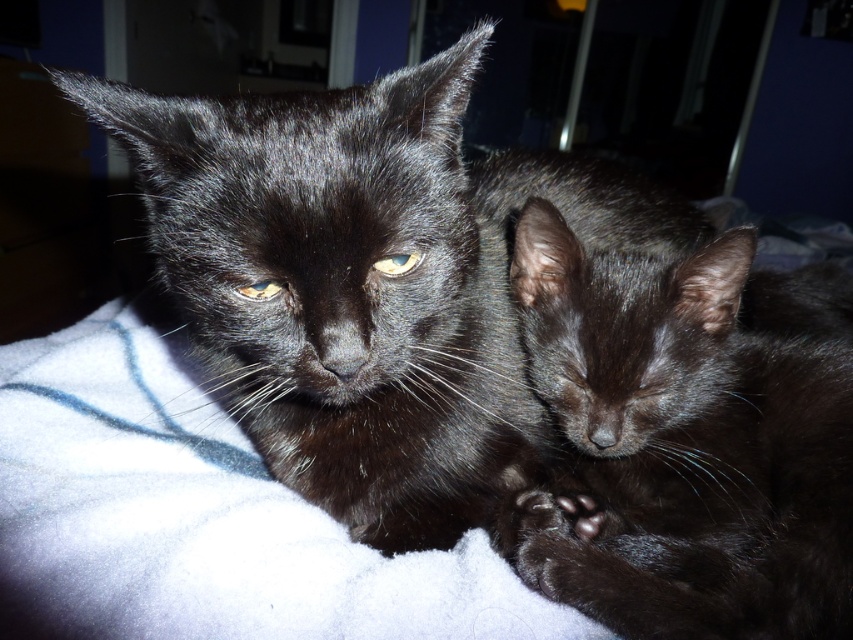
You are a photographer trying to capture the shiny black cat at center. Based on its position, where should you aim your camera to ensure it is centered in the frame?

To center the shiny black cat at center in the frame, aim your camera at the point with coordinates 0.442 on the x axis and 0.431 on the y axis.

You are a photographer trying to capture a closeup of both the shiny black kitten at center and the matte black eye at center in the image. Which object should you focus on to ensure it fills more of the frame?

The shiny black kitten at center might be wider than matte black eye at center, so focusing on the shiny black kitten at center would fill more of the frame.

You are a photographer trying to capture a closeup shot of the shiny black cat at center and the matte black eye at center. Since the lighting is dim, you need to adjust your camera settings. Which object should you focus on first to ensure proper exposure, the one closer to the light source or the one farther away?

The shiny black cat at center is to the right of matte black eye at center. Since the faint glow is coming from behind them, the object closer to the light source would be the one nearer to the glow. However, without knowing their exact positions relative to the light, it is impossible to determine which requires adjustment first. Please clarify their positions relative to the light source.